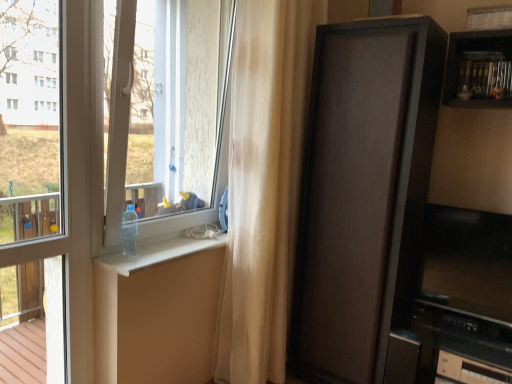
Question: Is matte brown cabinet at right bigger than sheer beige curtain at center?

Choices:
 (A) yes
 (B) no

Answer: (A)

Question: Can you confirm if matte brown cabinet at right is positioned to the right of sheer beige curtain at center?

Choices:
 (A) no
 (B) yes

Answer: (B)

Question: Is matte brown cabinet at right positioned far away from sheer beige curtain at center?

Choices:
 (A) no
 (B) yes

Answer: (A)

Question: Is matte brown cabinet at right closer to camera compared to sheer beige curtain at center?

Choices:
 (A) yes
 (B) no

Answer: (B)

Question: Is matte brown cabinet at right wider than sheer beige curtain at center?

Choices:
 (A) no
 (B) yes

Answer: (B)

Question: Is sheer beige curtain at center wider or thinner than clear plastic bottle at lower center?

Choices:
 (A) wide
 (B) thin

Answer: (A)

Question: From the image's perspective, is sheer beige curtain at center positioned above or below clear plastic bottle at lower center?

Choices:
 (A) above
 (B) below

Answer: (A)

Question: From a real-world perspective, is sheer beige curtain at center above or below clear plastic bottle at lower center?

Choices:
 (A) above
 (B) below

Answer: (A)

Question: Would you say sheer beige curtain at center is inside or outside clear plastic bottle at lower center?

Choices:
 (A) outside
 (B) inside

Answer: (A)

Question: Considering the positions of clear plastic bottle at lower center and matte brown cabinet at right in the image, is clear plastic bottle at lower center wider or thinner than matte brown cabinet at right?

Choices:
 (A) wide
 (B) thin

Answer: (B)

Question: Looking at the image, does clear plastic bottle at lower center seem bigger or smaller compared to matte brown cabinet at right?

Choices:
 (A) small
 (B) big

Answer: (A)

Question: From the image's perspective, is clear plastic bottle at lower center positioned above or below matte brown cabinet at right?

Choices:
 (A) above
 (B) below

Answer: (B)

Question: In the image, is clear plastic bottle at lower center on the left side or the right side of matte brown cabinet at right?

Choices:
 (A) left
 (B) right

Answer: (A)

Question: From a real-world perspective, is clear glass window at left above or below clear plastic bottle at lower center?

Choices:
 (A) above
 (B) below

Answer: (A)

Question: In the image, is clear glass window at left on the left side or the right side of clear plastic bottle at lower center?

Choices:
 (A) right
 (B) left

Answer: (B)